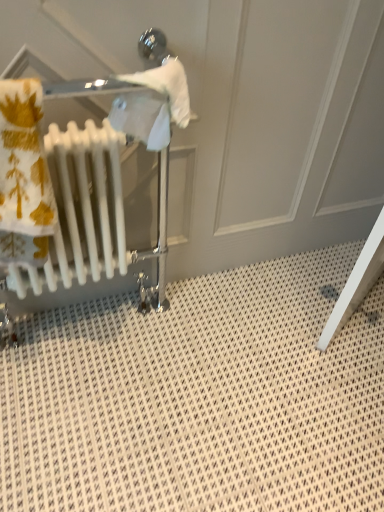
What do you see at coordinates (91, 214) in the screenshot? This screenshot has width=384, height=512. I see `white glossy radiator at left` at bounding box center [91, 214].

Locate an element on the screen. The height and width of the screenshot is (512, 384). white glossy radiator at left is located at coordinates coord(91,214).

What are the coordinates of `white plastic radiator at left` in the screenshot? It's located at (81, 210).

Image resolution: width=384 pixels, height=512 pixels. Describe the element at coordinates (81, 210) in the screenshot. I see `white plastic radiator at left` at that location.

Identify the location of white glossy radiator at left. This screenshot has height=512, width=384. (91, 214).

Considering the relative positions of white plastic radiator at left and white glossy radiator at left in the image provided, is white plastic radiator at left to the left or to the right of white glossy radiator at left?

From the image, it's evident that white plastic radiator at left is to the left of white glossy radiator at left.

Looking at this image, is white plastic radiator at left closer to the viewer compared to white glossy radiator at left?

Yes, the depth of white plastic radiator at left is less than that of white glossy radiator at left.

Considering the positions of points (80, 149) and (95, 232), is point (80, 149) closer to camera compared to point (95, 232)?

Yes, it is in front of point (95, 232).

From the image's perspective, which one is positioned higher, white plastic radiator at left or white glossy radiator at left?

From the image's view, white plastic radiator at left is above.

From a real-world perspective, is white plastic radiator at left beneath white glossy radiator at left?

No, from a real-world perspective, white plastic radiator at left is not beneath white glossy radiator at left.

Between white plastic radiator at left and white glossy radiator at left, which one has smaller width?

Thinner between the two is white plastic radiator at left.

Considering the sizes of objects white plastic radiator at left and white glossy radiator at left in the image provided, who is taller, white plastic radiator at left or white glossy radiator at left?

With more height is white glossy radiator at left.

Is white plastic radiator at left bigger or smaller than white glossy radiator at left?

In the image, white plastic radiator at left appears to be smaller than white glossy radiator at left.

Is white glossy radiator at left a part of white plastic radiator at left?

That's incorrect, white glossy radiator at left is not inside white plastic radiator at left.

Based on the photo, are white plastic radiator at left and white glossy radiator at left beside each other?

Indeed, white plastic radiator at left and white glossy radiator at left are beside each other and touching.

Could you tell me if white plastic radiator at left is facing white glossy radiator at left?

No, white plastic radiator at left is not aimed at white glossy radiator at left.

Measure the distance between white plastic radiator at left and white glossy radiator at left.

The distance of white plastic radiator at left from white glossy radiator at left is 3.40 centimeters.

Identify the location of baby carriage that appears below the white plastic radiator at left (from a real-world perspective). (91, 214).

Visually, is white glossy radiator at left positioned to the left or to the right of white plastic radiator at left?

white glossy radiator at left is positioned on white plastic radiator at left's right side.

Which object is closer to the camera taking this photo, white glossy radiator at left or white plastic radiator at left?

white plastic radiator at left is more forward.

Is point (63, 186) behind point (90, 164)?

No, it is in front of (90, 164).

From the image's perspective, is white glossy radiator at left positioned above or below white plastic radiator at left?

Clearly, from the image's perspective, white glossy radiator at left is below white plastic radiator at left.

From a real-world perspective, is white glossy radiator at left over white plastic radiator at left?

Incorrect, from a real-world perspective, white glossy radiator at left is lower than white plastic radiator at left.

Considering the relative sizes of white glossy radiator at left and white plastic radiator at left in the image provided, is white glossy radiator at left thinner than white plastic radiator at left?

No.

Considering the sizes of white glossy radiator at left and white plastic radiator at left in the image, is white glossy radiator at left taller or shorter than white plastic radiator at left?

In the image, white glossy radiator at left appears to be taller than white plastic radiator at left.

Which of these two, white glossy radiator at left or white plastic radiator at left, is bigger?

white glossy radiator at left.

Is white glossy radiator at left outside of white plastic radiator at left?

white glossy radiator at left lies outside white plastic radiator at left's area.

Does white glossy radiator at left touch white plastic radiator at left?

Yes, white glossy radiator at left is with white plastic radiator at left.

Is white glossy radiator at left turned away from white plastic radiator at left?

That's right, white glossy radiator at left is facing away from white plastic radiator at left.

Measure the distance between white glossy radiator at left and white plastic radiator at left.

A distance of 1.34 inches exists between white glossy radiator at left and white plastic radiator at left.

I want to click on baby carriage located behind the white plastic radiator at left, so click(x=91, y=214).

Find the location of a particular element. This screenshot has height=512, width=384. radiator above the white glossy radiator at left (from a real-world perspective) is located at coordinates (81, 210).

Locate an element on the screen. baby carriage below the white plastic radiator at left (from the image's perspective) is located at coordinates (91, 214).